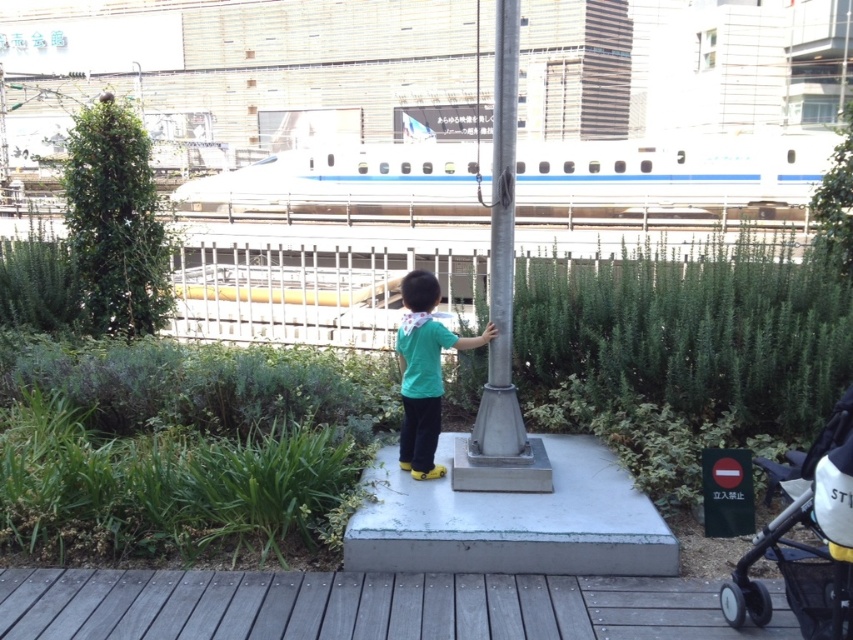
You are standing at the position of the child in the image. The white glossy train at upper center is located at coordinates approximately 0.277 on the x axis and 0.790 on the y axis. If you were to face directly towards the train, which direction would you need to turn from your current facing direction?

The white glossy train at upper center is located at coordinates approximately 0.277 on the x axis and 0.790 on the y axis. Since the child is facing forward, the direction to face the train would depend on the orientation of the image. However, based on standard image coordinate systems where the origin is at the bottom left, the train is to the upper center. Therefore, the child should turn upward or look towards the upper part of the image to face the train.

You are standing at the point marked by the coordinates point (x=672, y=177) in the image. What object are you directly facing?

You are directly facing the white glossy train at upper center.

You are a photographer trying to capture a photo of the green matte shirt at center and the metallic gray pole at center. Since you want to ensure both are in focus, you need to know their relative sizes. Which object is bigger?

The metallic gray pole at center has a larger size compared to green matte shirt at center, so the metallic gray pole at center is bigger.